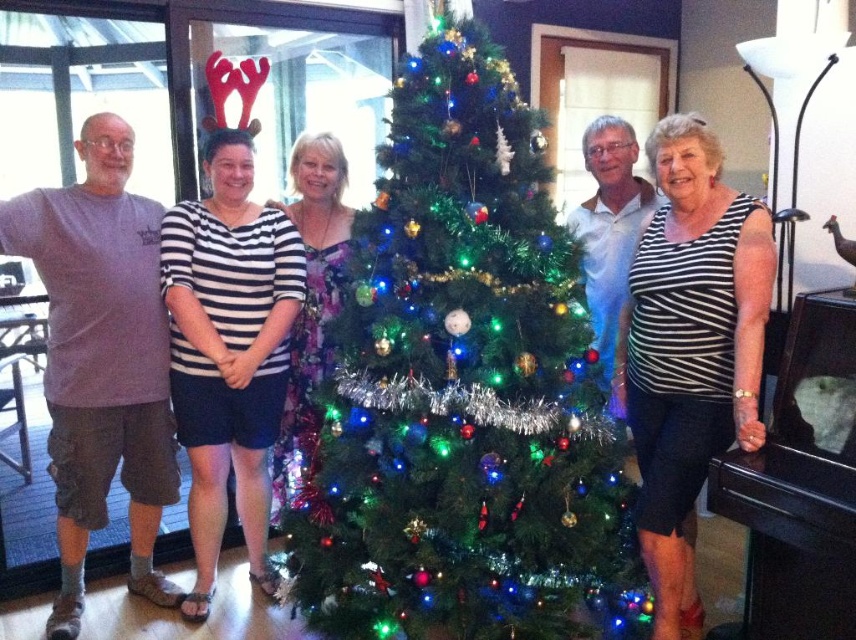
Question: Does purple cotton t-shirt at left have a greater width compared to black striped tank top at right?

Choices:
 (A) yes
 (B) no

Answer: (A)

Question: Which object appears closest to the camera in this image?

Choices:
 (A) striped fabric shirt at center
 (B) black striped tank top at right
 (C) green shiny christmas tree at center

Answer: (B)

Question: Is green shiny christmas tree at center to the left of purple cotton t-shirt at left from the viewer's perspective?

Choices:
 (A) yes
 (B) no

Answer: (B)

Question: Which object appears closest to the camera in this image?

Choices:
 (A) purple cotton t-shirt at left
 (B) black striped tank top at right
 (C) striped fabric shirt at center

Answer: (B)

Question: Is black striped tank top at right positioned at the back of striped fabric shirt at center?

Choices:
 (A) no
 (B) yes

Answer: (A)

Question: Which point is closer to the camera?

Choices:
 (A) (700, 275)
 (B) (223, 148)

Answer: (A)